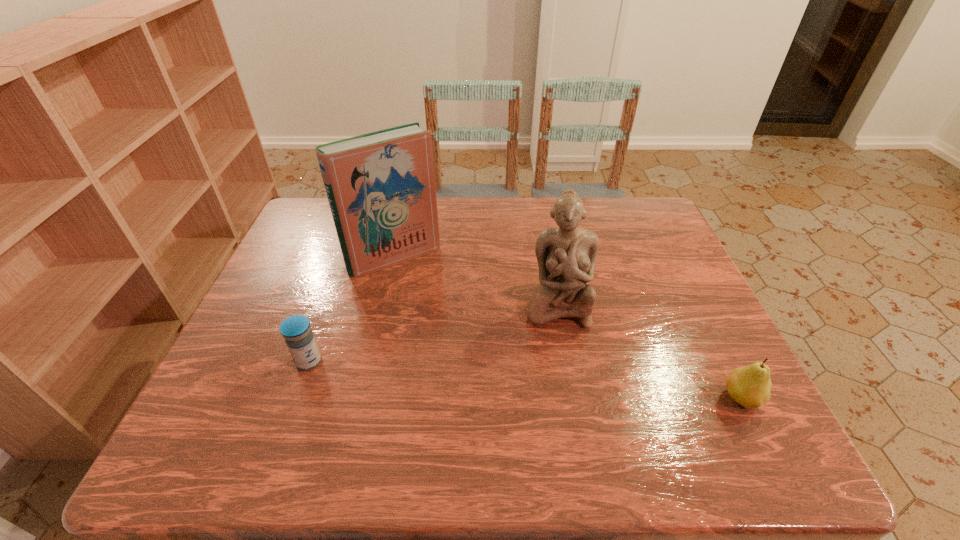
Locate an element on the screen. free space at the far edge of the desktop is located at coordinates (492, 211).

In the image, there is a desktop. Identify the location of vacant space at the near edge. (459, 403).

The width and height of the screenshot is (960, 540). In the image, there is a desktop. Identify the location of free region at the right edge. (703, 311).

The width and height of the screenshot is (960, 540). In the image, there is a desktop. Identify the location of free space at the far left corner. (301, 217).

This screenshot has height=540, width=960. In the image, there is a desktop. What are the coordinates of `free space at the far right corner` in the screenshot? It's located at (620, 232).

Where is `free space between the figurine and the medicine`? free space between the figurine and the medicine is located at coordinates (433, 334).

You are a GUI agent. You are given a task and a screenshot of the screen. Output one action in this format:
    pyautogui.click(x=<x>, y=<y>)
    Task: Click on the free spot between the third nearest object and the rightmost object
    
    Given the screenshot: What is the action you would take?
    pyautogui.click(x=649, y=352)

Image resolution: width=960 pixels, height=540 pixels. Find the location of `vacant space that is in between the tallest object and the figurine`. vacant space that is in between the tallest object and the figurine is located at coordinates (476, 281).

Locate an element on the screen. The height and width of the screenshot is (540, 960). vacant area that lies between the farthest object and the third object from left to right is located at coordinates (476, 281).

Locate an element on the screen. This screenshot has width=960, height=540. empty space between the third object from left to right and the rightmost object is located at coordinates (649, 352).